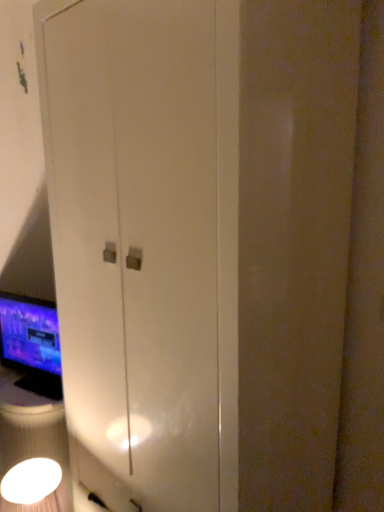
Question: From the image's perspective, is white glossy light fixture at lower left located above or below matte black monitor at left?

Choices:
 (A) below
 (B) above

Answer: (A)

Question: Considering the positions of white glossy light fixture at lower left and matte black monitor at left in the image, is white glossy light fixture at lower left taller or shorter than matte black monitor at left?

Choices:
 (A) tall
 (B) short

Answer: (B)

Question: Is white glossy light fixture at lower left wider or thinner than matte black monitor at left?

Choices:
 (A) thin
 (B) wide

Answer: (B)

Question: Is matte black monitor at left to the left or to the right of white glossy light fixture at lower left in the image?

Choices:
 (A) right
 (B) left

Answer: (B)

Question: From a real-world perspective, is matte black monitor at left physically located above or below white glossy light fixture at lower left?

Choices:
 (A) above
 (B) below

Answer: (A)

Question: Would you say matte black monitor at left is inside or outside white glossy light fixture at lower left?

Choices:
 (A) inside
 (B) outside

Answer: (B)

Question: Relative to white glossy light fixture at lower left, is matte black monitor at left in front or behind?

Choices:
 (A) behind
 (B) front

Answer: (A)